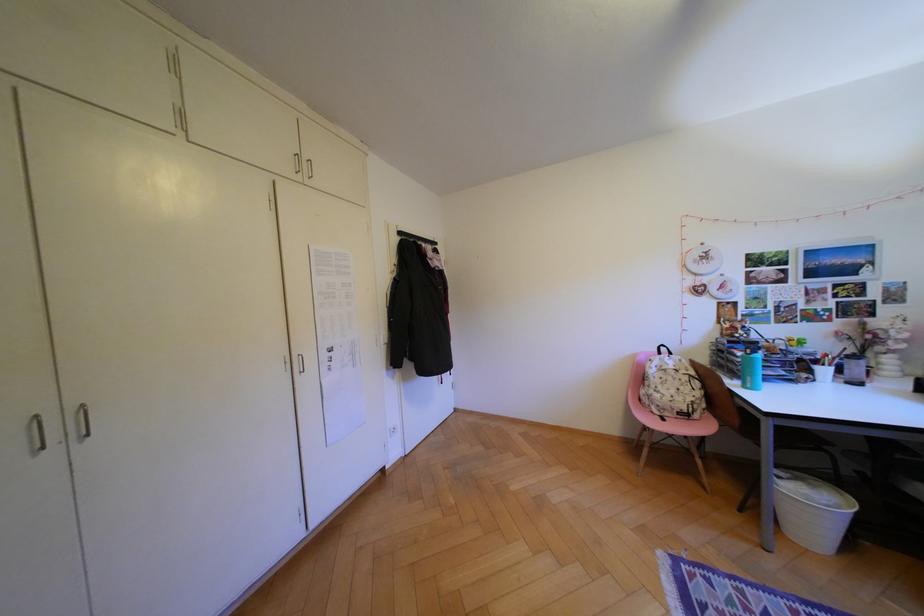
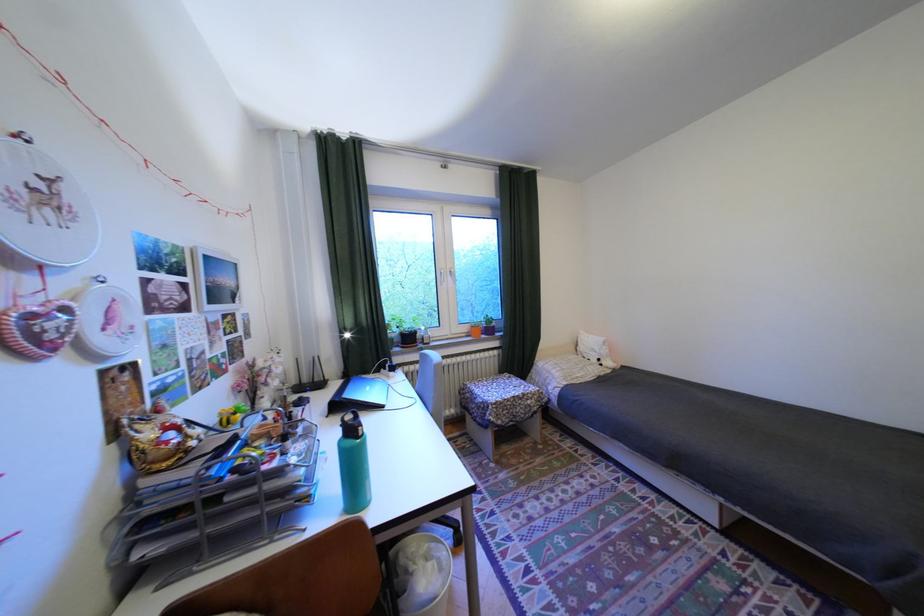
Find the pixel in the second image that matches (x=716, y=257) in the first image.

(58, 197)